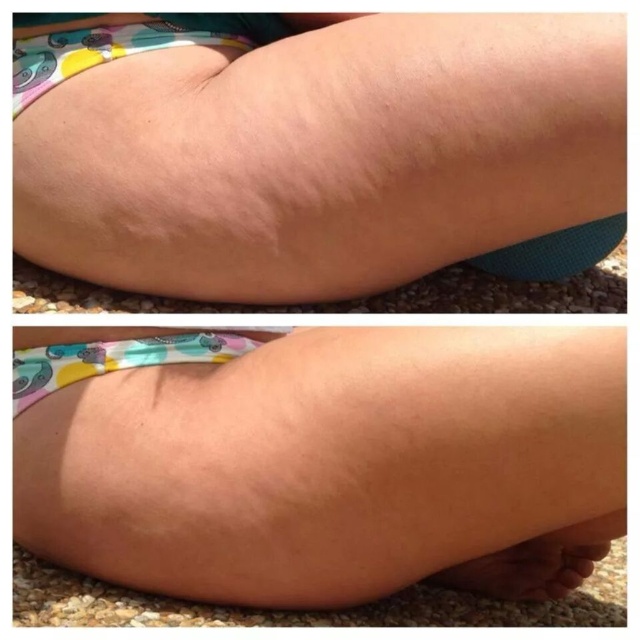
You are a photographer reviewing the composition of two images. In the top photo, you see a matte floral diaper at center and a brown matte toe at lower right. Which object is covering part of the other?

The matte floral diaper at center is positioned over brown matte toe at lower right, so it is covering part of the brown matte toe at lower right.

You are a medical professional examining the two photographs of the leg. You notice two areas labeled as smooth skin at center and smooth skin at lower center. Based on their positions, which area is closer to the viewer?

The smooth skin at center is closer to the viewer because the smooth skin at lower center is positioned behind it.